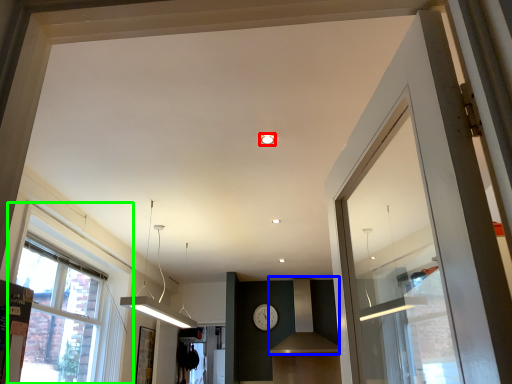
Question: Based on their relative distances, which object is farther from lighting (highlighted by a red box)? Choose from vent (highlighted by a blue box) and window (highlighted by a green box).

Choices:
 (A) vent
 (B) window

Answer: (A)